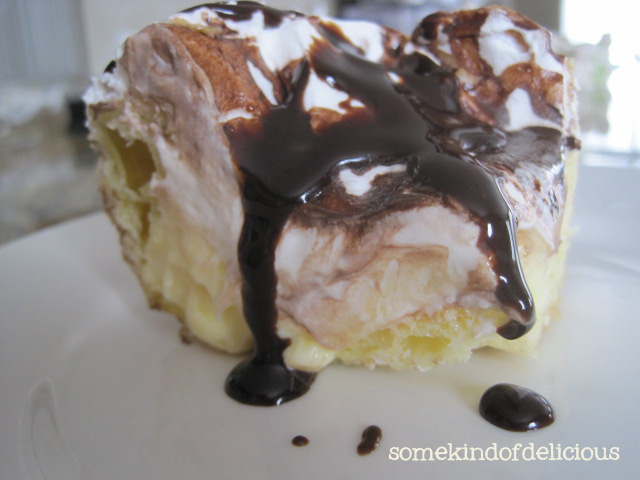
The image size is (640, 480). I want to click on dining room, so click(51, 191).